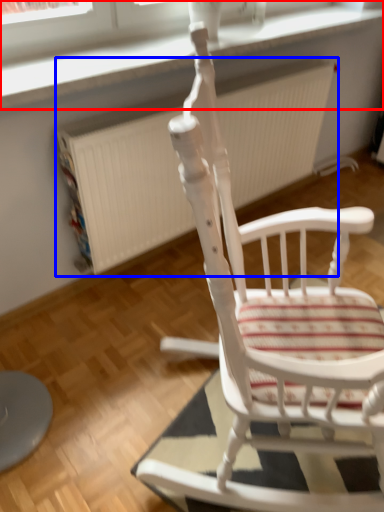
Question: Which object appears closest to the camera in this image, window frame (highlighted by a red box) or radiator (highlighted by a blue box)?

Choices:
 (A) window frame
 (B) radiator

Answer: (A)